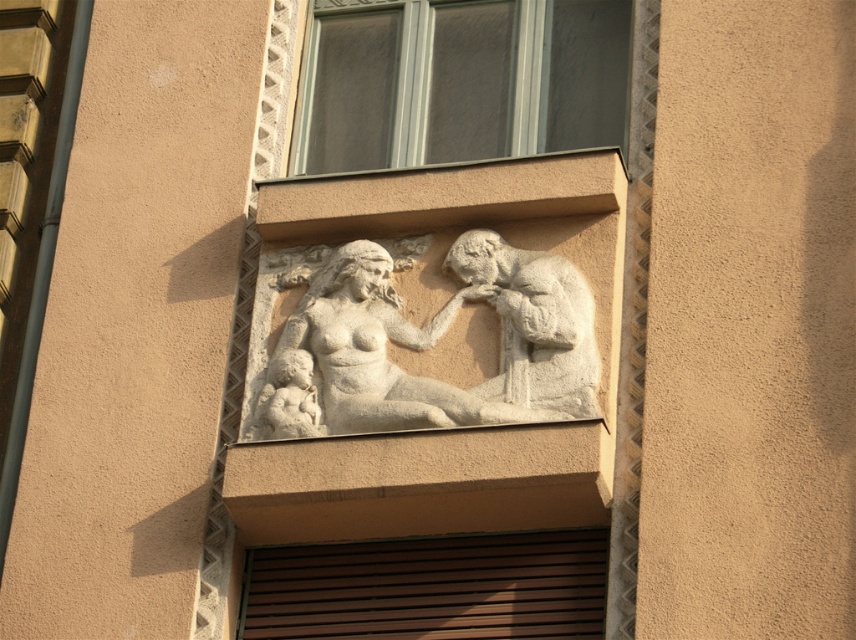
You are standing in front of the building and looking at the sculpted relief. There are two points marked on the relief. One is at coordinate point (x=337, y=340) and the other is at point (x=524, y=285). Which point is closer to you?

Point (x=337, y=340) is further to the camera than point (x=524, y=285). Therefore, point (x=524, y=285) is closer to you.

You are standing in front of the building and want to take a photo of the clear glass window at upper center. If your camera has a maximum focus range of 50 meters, will you be able to capture the window clearly?

The clear glass window at upper center is 51.31 meters away from camera, so the camera cannot focus on it since it exceeds the maximum range of 50 meters.